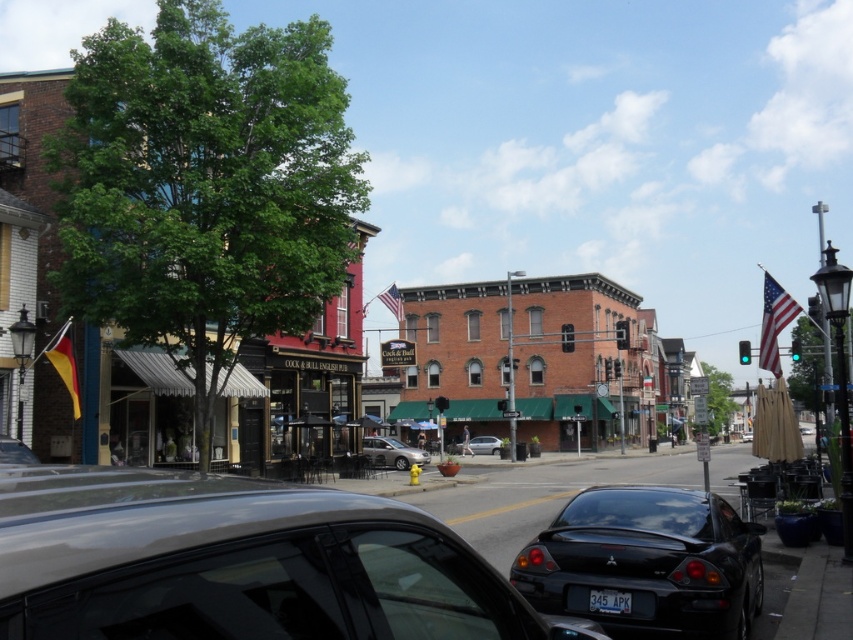
Who is lower down, glossy black car at center or silver metallic sedan at center?

silver metallic sedan at center is lower down.

Is point (543, 588) farther from camera compared to point (473, 438)?

No, (543, 588) is in front of (473, 438).

Who is more forward, (701, 570) or (485, 442)?

Point (701, 570) is in front.

Identify the location of glossy black car at center. This screenshot has width=853, height=640. (647, 563).

Which is more to the left, black asphalt at center or silver metallic sedan at center?

silver metallic sedan at center

Does point (506, 492) come in front of point (479, 435)?

Yes, it is.

This screenshot has height=640, width=853. Identify the location of black asphalt at center. (538, 497).

Is shiny gray car at center above brick building at center?

No.

Does shiny gray car at center have a lesser height compared to brick building at center?

Indeed, shiny gray car at center has a lesser height compared to brick building at center.

Who is more distant from viewer, (21,625) or (390,186)?

The point (390,186) is behind.

The image size is (853, 640). Find the location of `shiny gray car at center`. shiny gray car at center is located at coordinates (239, 563).